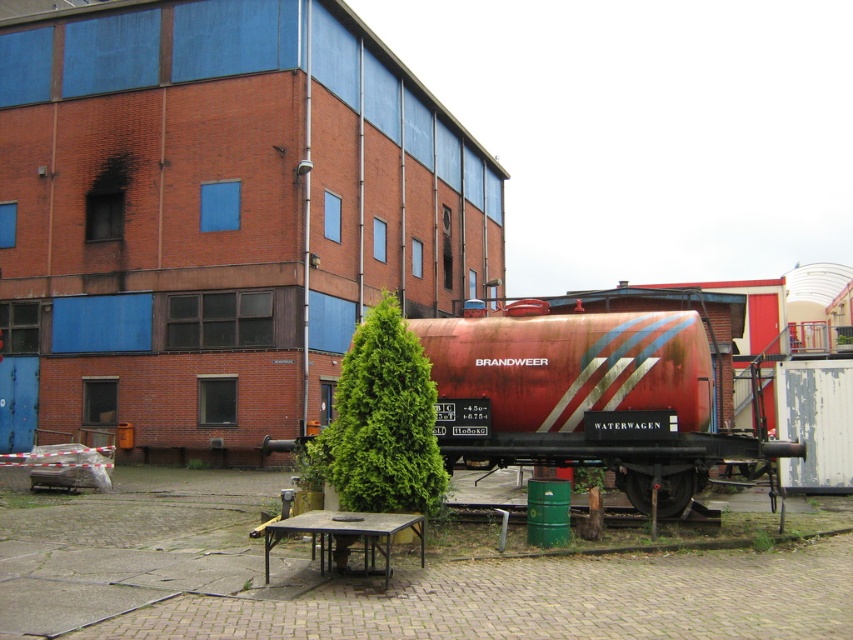
You are a maintenance worker needing to move a 3.5 meter long pipe from the rusty metal tank at center to the wooden picnic table at lower center. Can you transport it without bending the pipe?

The distance between the rusty metal tank at center and the wooden picnic table at lower center is 3.40 meters. Since the pipe is 3.5 meters long, it is slightly longer than the distance between them. Therefore, you cannot transport the pipe without bending it.